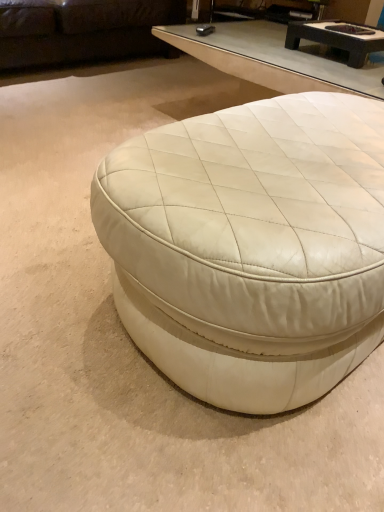
Image resolution: width=384 pixels, height=512 pixels. Describe the element at coordinates (337, 38) in the screenshot. I see `dark brown textured wood coffee table at upper center, positioned as the first coffee table in top-to-bottom order` at that location.

The width and height of the screenshot is (384, 512). In order to click on dark brown textured wood coffee table at upper center, positioned as the first coffee table in top-to-bottom order in this screenshot , I will do `click(337, 38)`.

What is the approximate width of white leather ottoman at center, the 1th coffee table in the front-to-back sequence?

white leather ottoman at center, the 1th coffee table in the front-to-back sequence, is 27.24 inches in width.

Where is `dark brown leather couch at upper left`? This screenshot has height=512, width=384. dark brown leather couch at upper left is located at coordinates (82, 30).

Which of these two, white leather ottoman at center, which is the 2th coffee table in back-to-front order, or dark brown textured wood coffee table at upper center, acting as the 1th coffee table starting from the back, is wider?

With larger width is white leather ottoman at center, which is the 2th coffee table in back-to-front order.

How different are the orientations of white leather ottoman at center, acting as the 1th coffee table starting from the bottom, and dark brown textured wood coffee table at upper center, acting as the second coffee table starting from the front, in degrees?

The facing directions of white leather ottoman at center, acting as the 1th coffee table starting from the bottom, and dark brown textured wood coffee table at upper center, acting as the second coffee table starting from the front, are 87.5 degrees apart.

Is white leather ottoman at center, positioned as the second coffee table in top-to-bottom order, positioned with its back to dark brown textured wood coffee table at upper center, positioned as the first coffee table in top-to-bottom order?

No.

From the image's perspective, who appears lower, white leather ottoman at center, which is the 2th coffee table in back-to-front order, or dark brown textured wood coffee table at upper center, positioned as the first coffee table in top-to-bottom order?

white leather ottoman at center, which is the 2th coffee table in back-to-front order, appears lower in the image.

From a real-world perspective, is dark brown leather couch at upper left physically located above or below white leather ottoman at center, the 1th coffee table in the front-to-back sequence?

From a real-world perspective, dark brown leather couch at upper left is physically above white leather ottoman at center, the 1th coffee table in the front-to-back sequence.

Is dark brown leather couch at upper left bigger or smaller than white leather ottoman at center, positioned as the second coffee table in top-to-bottom order?

In the image, dark brown leather couch at upper left appears to be larger than white leather ottoman at center, positioned as the second coffee table in top-to-bottom order.

Is dark brown leather couch at upper left far away from white leather ottoman at center, positioned as the second coffee table in top-to-bottom order?

Yes, dark brown leather couch at upper left and white leather ottoman at center, positioned as the second coffee table in top-to-bottom order, are quite far apart.

Considering the positions of objects dark brown leather couch at upper left and white leather ottoman at center, the 1th coffee table in the front-to-back sequence, in the image provided, who is more to the left, dark brown leather couch at upper left or white leather ottoman at center, the 1th coffee table in the front-to-back sequence,?

dark brown leather couch at upper left.

In terms of width, does dark brown textured wood coffee table at upper center, acting as the second coffee table starting from the front, look wider or thinner when compared to white leather ottoman at center, which is the 2th coffee table in back-to-front order?

In the image, dark brown textured wood coffee table at upper center, acting as the second coffee table starting from the front, appears to be more narrow than white leather ottoman at center, which is the 2th coffee table in back-to-front order.

From the picture: Is dark brown textured wood coffee table at upper center, the second coffee table in the bottom-to-top sequence, bigger or smaller than white leather ottoman at center, the 1th coffee table in the front-to-back sequence?

Considering their sizes, dark brown textured wood coffee table at upper center, the second coffee table in the bottom-to-top sequence, takes up less space than white leather ottoman at center, the 1th coffee table in the front-to-back sequence.

In the scene shown: Between dark brown textured wood coffee table at upper center, acting as the second coffee table starting from the front, and white leather ottoman at center, positioned as the second coffee table in top-to-bottom order, which one has more height?

white leather ottoman at center, positioned as the second coffee table in top-to-bottom order, is taller.

How far apart are dark brown textured wood coffee table at upper center, the second coffee table in the bottom-to-top sequence, and white leather ottoman at center, the 1th coffee table in the front-to-back sequence?

dark brown textured wood coffee table at upper center, the second coffee table in the bottom-to-top sequence, is 3.52 feet away from white leather ottoman at center, the 1th coffee table in the front-to-back sequence.

Could you tell me if dark brown textured wood coffee table at upper center, acting as the 1th coffee table starting from the back, is turned towards dark brown leather couch at upper left?

No, dark brown textured wood coffee table at upper center, acting as the 1th coffee table starting from the back, is not oriented towards dark brown leather couch at upper left.

Which of these two, dark brown textured wood coffee table at upper center, acting as the second coffee table starting from the front, or dark brown leather couch at upper left, stands taller?

dark brown leather couch at upper left.

Which object is more forward, dark brown textured wood coffee table at upper center, the second coffee table in the bottom-to-top sequence, or dark brown leather couch at upper left?

dark brown textured wood coffee table at upper center, the second coffee table in the bottom-to-top sequence, is in front.

Based on their positions, is dark brown textured wood coffee table at upper center, positioned as the first coffee table in top-to-bottom order, located to the left or right of dark brown leather couch at upper left?

In the image, dark brown textured wood coffee table at upper center, positioned as the first coffee table in top-to-bottom order, appears on the right side of dark brown leather couch at upper left.

How many degrees apart are the facing directions of white leather ottoman at center, which is the 2th coffee table in back-to-front order, and dark brown leather couch at upper left?

The angular difference between white leather ottoman at center, which is the 2th coffee table in back-to-front order, and dark brown leather couch at upper left is 179 degrees.

Which is correct: white leather ottoman at center, acting as the 1th coffee table starting from the bottom, is inside dark brown leather couch at upper left, or outside of it?

white leather ottoman at center, acting as the 1th coffee table starting from the bottom, exists outside the volume of dark brown leather couch at upper left.

Considering the relative sizes of white leather ottoman at center, the 1th coffee table in the front-to-back sequence, and dark brown leather couch at upper left in the image provided, is white leather ottoman at center, the 1th coffee table in the front-to-back sequence, smaller than dark brown leather couch at upper left?

Indeed, white leather ottoman at center, the 1th coffee table in the front-to-back sequence, has a smaller size compared to dark brown leather couch at upper left.

Does point (318, 329) lie in front of point (86, 47)?

That is True.

Which of these two, dark brown leather couch at upper left or dark brown textured wood coffee table at upper center, acting as the 1th coffee table starting from the back, is thinner?

dark brown textured wood coffee table at upper center, acting as the 1th coffee table starting from the back, is thinner.

Looking at this image, from the image's perspective, who appears lower, dark brown leather couch at upper left or dark brown textured wood coffee table at upper center, positioned as the first coffee table in top-to-bottom order?

From the image's view, dark brown textured wood coffee table at upper center, positioned as the first coffee table in top-to-bottom order, is below.

Is dark brown leather couch at upper left far from dark brown textured wood coffee table at upper center, acting as the 1th coffee table starting from the back?

dark brown leather couch at upper left is positioned a significant distance from dark brown textured wood coffee table at upper center, acting as the 1th coffee table starting from the back.

In the image, there is a dark brown textured wood coffee table at upper center, positioned as the first coffee table in top-to-bottom order. Where is `coffee table below it (from the image's perspective)`? coffee table below it (from the image's perspective) is located at coordinates (251, 246).

Locate an element on the screen. The width and height of the screenshot is (384, 512). studio couch on the left of the white leather ottoman at center, acting as the 1th coffee table starting from the bottom is located at coordinates (82, 30).

Estimate the real-world distances between objects in this image. Which object is closer to dark brown leather couch at upper left, white leather ottoman at center, which is the 2th coffee table in back-to-front order, or dark brown textured wood coffee table at upper center, acting as the 1th coffee table starting from the back?

Among the two, dark brown textured wood coffee table at upper center, acting as the 1th coffee table starting from the back, is located nearer to dark brown leather couch at upper left.

From the image, which object appears to be farther from dark brown leather couch at upper left, dark brown textured wood coffee table at upper center, acting as the 1th coffee table starting from the back, or white leather ottoman at center, the 1th coffee table in the front-to-back sequence?

The object further to dark brown leather couch at upper left is white leather ottoman at center, the 1th coffee table in the front-to-back sequence.

Estimate the real-world distances between objects in this image. Which object is closer to white leather ottoman at center, which is the 2th coffee table in back-to-front order, dark brown leather couch at upper left or dark brown textured wood coffee table at upper center, the second coffee table in the bottom-to-top sequence?

dark brown textured wood coffee table at upper center, the second coffee table in the bottom-to-top sequence, is closer to white leather ottoman at center, which is the 2th coffee table in back-to-front order.

From the image, which object appears to be farther from dark brown textured wood coffee table at upper center, acting as the 1th coffee table starting from the back, dark brown leather couch at upper left or white leather ottoman at center, which is the 2th coffee table in back-to-front order?

Among the two, dark brown leather couch at upper left is located further to dark brown textured wood coffee table at upper center, acting as the 1th coffee table starting from the back.

From the picture: Based on their spatial positions, is dark brown textured wood coffee table at upper center, the second coffee table in the bottom-to-top sequence, or dark brown leather couch at upper left further from white leather ottoman at center, which is the 2th coffee table in back-to-front order?

dark brown leather couch at upper left is further to white leather ottoman at center, which is the 2th coffee table in back-to-front order.

Which object lies nearer to the anchor point dark brown textured wood coffee table at upper center, the second coffee table in the bottom-to-top sequence, white leather ottoman at center, acting as the 1th coffee table starting from the bottom, or dark brown leather couch at upper left?

The object closer to dark brown textured wood coffee table at upper center, the second coffee table in the bottom-to-top sequence, is white leather ottoman at center, acting as the 1th coffee table starting from the bottom.

Locate an element on the screen. This screenshot has height=512, width=384. coffee table located between white leather ottoman at center, positioned as the second coffee table in top-to-bottom order, and dark brown leather couch at upper left in the depth direction is located at coordinates (337, 38).